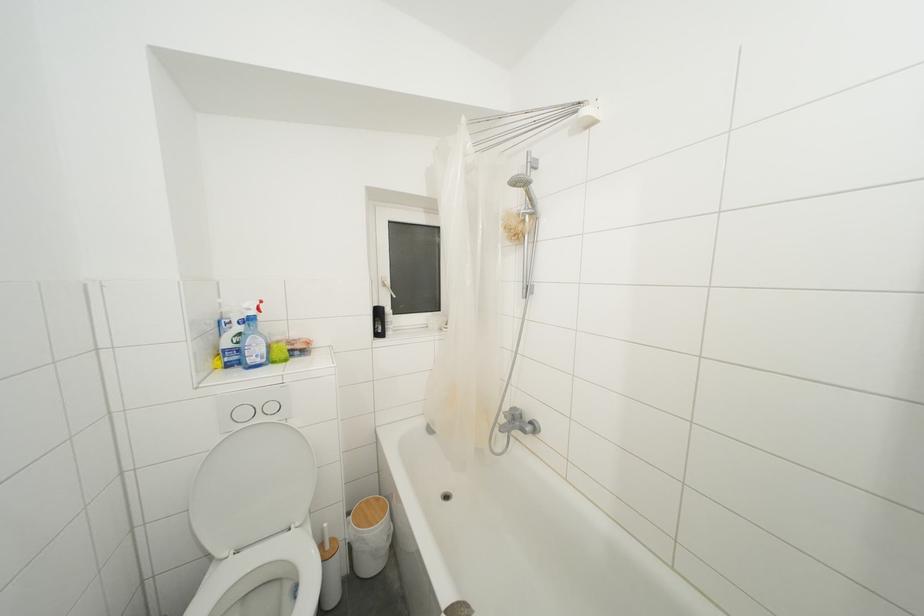
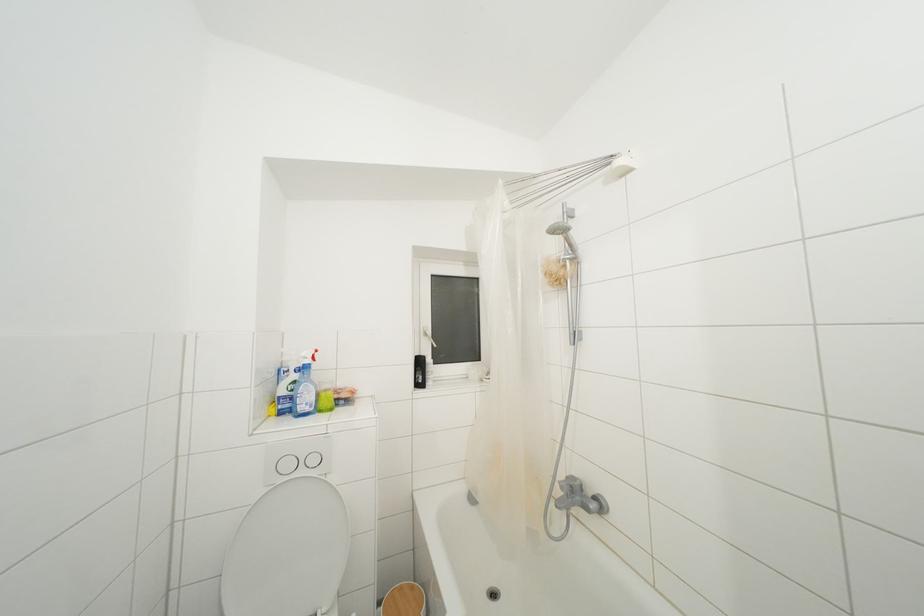
What movement of the cameraman would produce the second image?

The cameraman walked toward left, forward.